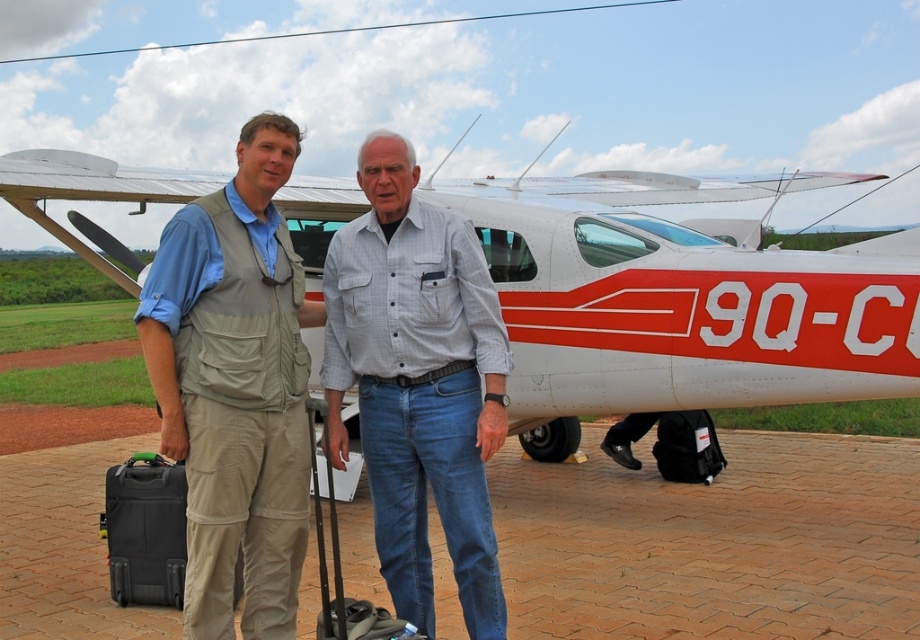
You are a photographer trying to capture a photo of the white matte airplane at center and the black hardshell suitcase at lower left. Since you want to include both in the frame, can you determine which object you need to focus on first based on their heights?

The white matte airplane at center is taller than the black hardshell suitcase at lower left, so you should focus on the white matte airplane at center first to ensure it is fully in frame.

You are a photographer positioned at the back of the airfield and want to capture both the gray cotton shirt at center and the black hardshell suitcase at lower left in your shot. Based on their positions, which object should you focus on first to ensure both are in frame?

The gray cotton shirt at center is above the black hardshell suitcase at lower left, so you should focus on the gray cotton shirt at center first to ensure both are in frame.

You are a photographer positioned at the origin point of the image coordinate system. You want to take a photo of the gray cotton shirt at center. What are the coordinates where you should aim your camera?

The coordinates where you should aim your camera are at point (418, 384), as that is the 2D location of the gray cotton shirt at center.